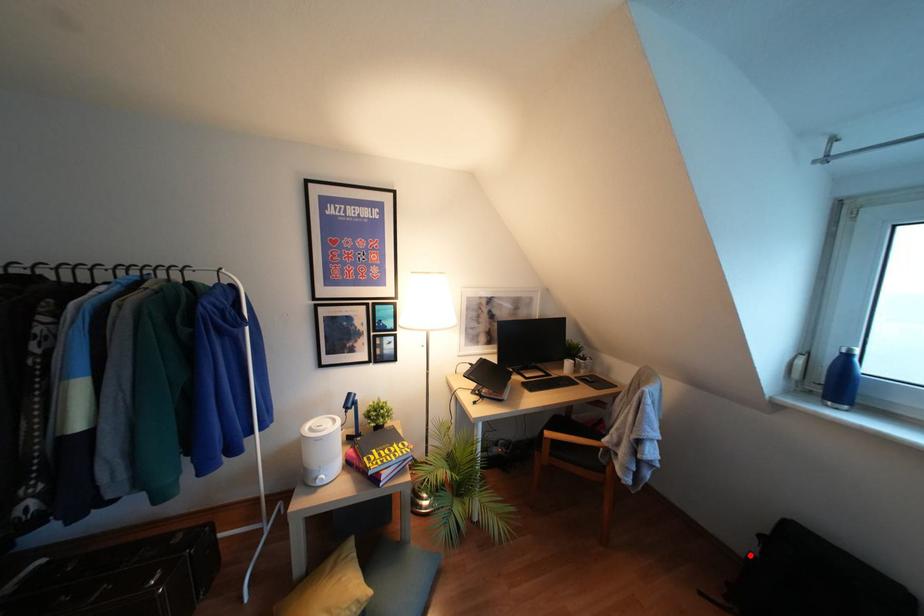
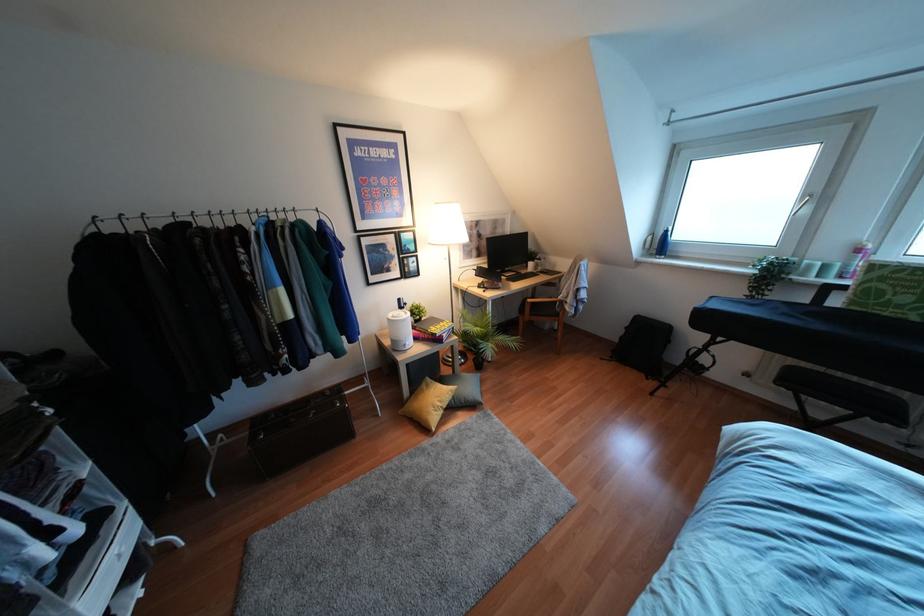
Question: I am providing you with two images of the same scene from different viewpoints. Given a red point in image1, look at the same physical point in image2. Is it:

Choices:
 (A) Closer to the viewpoint
 (B) Farther from the viewpoint

Answer: (A)